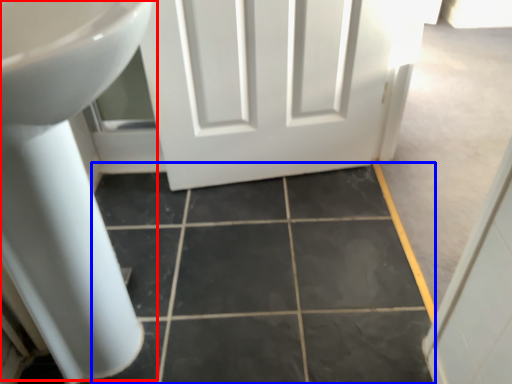
Question: Which point is closer to the camera, sink (highlighted by a red box) or ceramic tile (highlighted by a blue box)?

Choices:
 (A) sink
 (B) ceramic tile

Answer: (A)